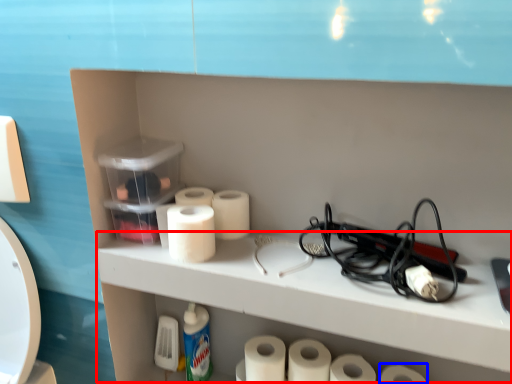
Question: Which object appears closest to the camera in this image, counter (highlighted by a red box) or toilet paper (highlighted by a blue box)?

Choices:
 (A) counter
 (B) toilet paper

Answer: (A)